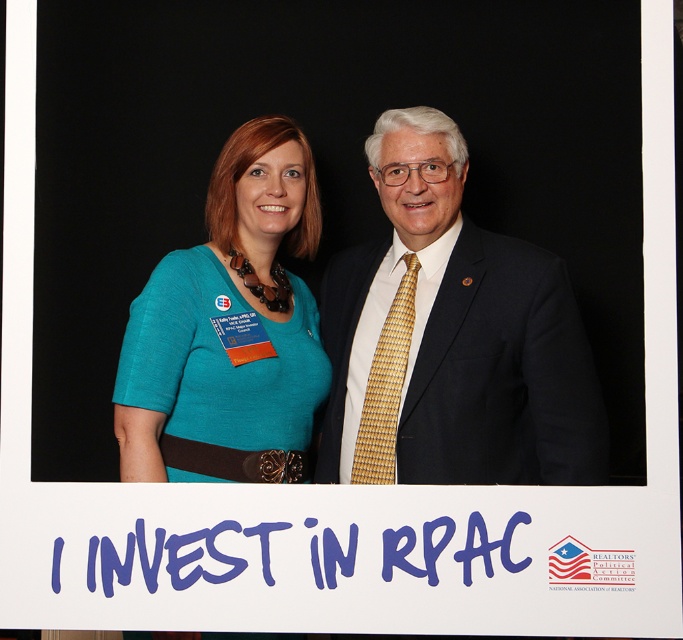
Which of these two, matte black suit at center or teal fabric dress at center, stands shorter?

Standing shorter between the two is teal fabric dress at center.

Is point (329, 448) closer to viewer compared to point (236, 316)?

No.

You are a GUI agent. You are given a task and a screenshot of the screen. Output one action in this format:
    pyautogui.click(x=<x>, y=<y>)
    Task: Click on the matte black suit at center
    The image size is (683, 640).
    Given the screenshot: What is the action you would take?
    pyautogui.click(x=451, y=337)

Does teal fabric dress at center appear under gold woven tie at center?

Incorrect, teal fabric dress at center is not positioned below gold woven tie at center.

The height and width of the screenshot is (640, 683). What are the coordinates of `teal fabric dress at center` in the screenshot? It's located at (229, 321).

Measure the distance between teal fabric dress at center and camera.

The distance of teal fabric dress at center from camera is 1.57 meters.

Find the location of a particular element. This screenshot has height=640, width=683. teal fabric dress at center is located at coordinates (229, 321).

Does matte black suit at center have a greater width compared to gold woven tie at center?

Yes.

Is matte black suit at center thinner than gold woven tie at center?

No, matte black suit at center is not thinner than gold woven tie at center.

Find the location of a particular element. This screenshot has width=683, height=640. matte black suit at center is located at coordinates (451, 337).